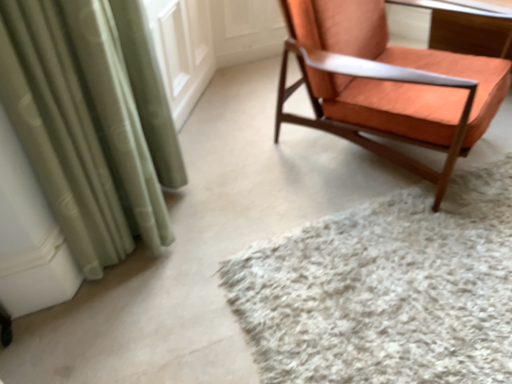
Question: From a real-world perspective, is orange fabric chair at upper right physically below wooden table at upper right?

Choices:
 (A) yes
 (B) no

Answer: (B)

Question: Does orange fabric chair at upper right have a greater height compared to wooden table at upper right?

Choices:
 (A) no
 (B) yes

Answer: (B)

Question: Is orange fabric chair at upper right completely or partially outside of wooden table at upper right?

Choices:
 (A) yes
 (B) no

Answer: (A)

Question: Does orange fabric chair at upper right have a lesser width compared to wooden table at upper right?

Choices:
 (A) yes
 (B) no

Answer: (B)

Question: Does orange fabric chair at upper right have a greater width compared to wooden table at upper right?

Choices:
 (A) yes
 (B) no

Answer: (A)

Question: Considering the positions of white shaggy rug at center and wooden table at upper right in the image, is white shaggy rug at center bigger or smaller than wooden table at upper right?

Choices:
 (A) big
 (B) small

Answer: (B)

Question: Looking at their shapes, would you say white shaggy rug at center is wider or thinner than wooden table at upper right?

Choices:
 (A) thin
 (B) wide

Answer: (B)

Question: From the image's perspective, relative to wooden table at upper right, is white shaggy rug at center above or below?

Choices:
 (A) below
 (B) above

Answer: (A)

Question: Based on their positions, is white shaggy rug at center located to the left or right of wooden table at upper right?

Choices:
 (A) right
 (B) left

Answer: (B)

Question: From a real-world perspective, is white shaggy rug at center physically located above or below orange fabric chair at upper right?

Choices:
 (A) above
 (B) below

Answer: (B)

Question: From the image's perspective, is white shaggy rug at center positioned above or below orange fabric chair at upper right?

Choices:
 (A) below
 (B) above

Answer: (A)

Question: Considering the positions of white shaggy rug at center and orange fabric chair at upper right in the image, is white shaggy rug at center bigger or smaller than orange fabric chair at upper right?

Choices:
 (A) big
 (B) small

Answer: (B)

Question: Does point (229, 289) appear closer or farther from the camera than point (290, 115)?

Choices:
 (A) closer
 (B) farther

Answer: (A)

Question: Is orange fabric chair at upper right inside or outside of wooden table at upper right?

Choices:
 (A) inside
 (B) outside

Answer: (B)

Question: From the image's perspective, is orange fabric chair at upper right located above or below wooden table at upper right?

Choices:
 (A) below
 (B) above

Answer: (A)